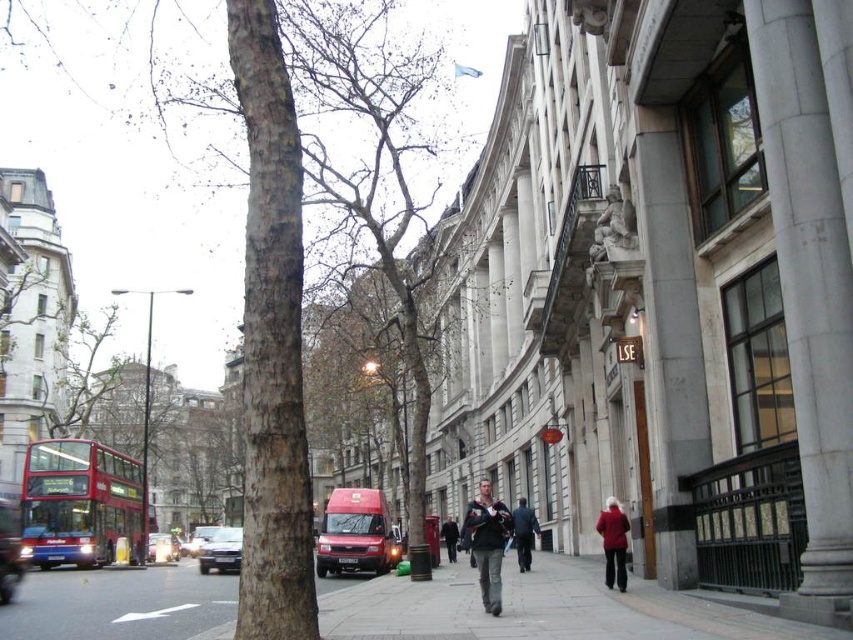
Question: Is silver metallic car at center bigger than dark gray jacket at center?

Choices:
 (A) yes
 (B) no

Answer: (A)

Question: Considering the real-world distances, which object is farthest from the matte red van at center?

Choices:
 (A) gray concrete sidewalk at center
 (B) dark blue jacket at center
 (C) silver metallic car at center

Answer: (A)

Question: Estimate the real-world distances between objects in this image. Which object is farther from the silver metallic car at center?

Choices:
 (A) red woolen sweater at center
 (B) red matte double-decker bus at left
 (C) smooth bark tree at center

Answer: (C)

Question: Observing the image, what is the correct spatial positioning of dark blue jacket at center in reference to metallic silver van at center?

Choices:
 (A) right
 (B) left

Answer: (A)

Question: Does smooth gray stone column at center right appear on the right side of matte red van at center?

Choices:
 (A) no
 (B) yes

Answer: (B)

Question: Which point is closer to the camera?

Choices:
 (A) matte red van at center
 (B) smooth gray stone column at center right
 (C) red woolen sweater at center
 (D) red matte double-decker bus at left

Answer: (B)